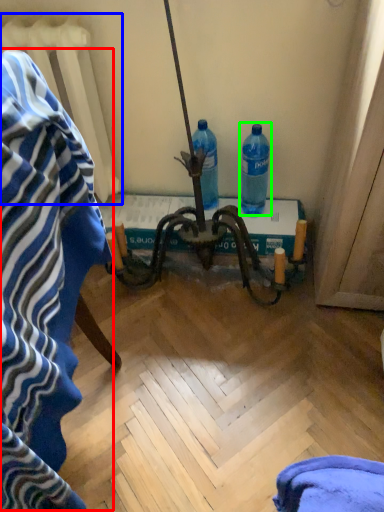
Question: Considering the real-world distances, which object is closest to bath towel (highlighted by a red box)? radiator (highlighted by a blue box) or bottle (highlighted by a green box).

Choices:
 (A) radiator
 (B) bottle

Answer: (A)